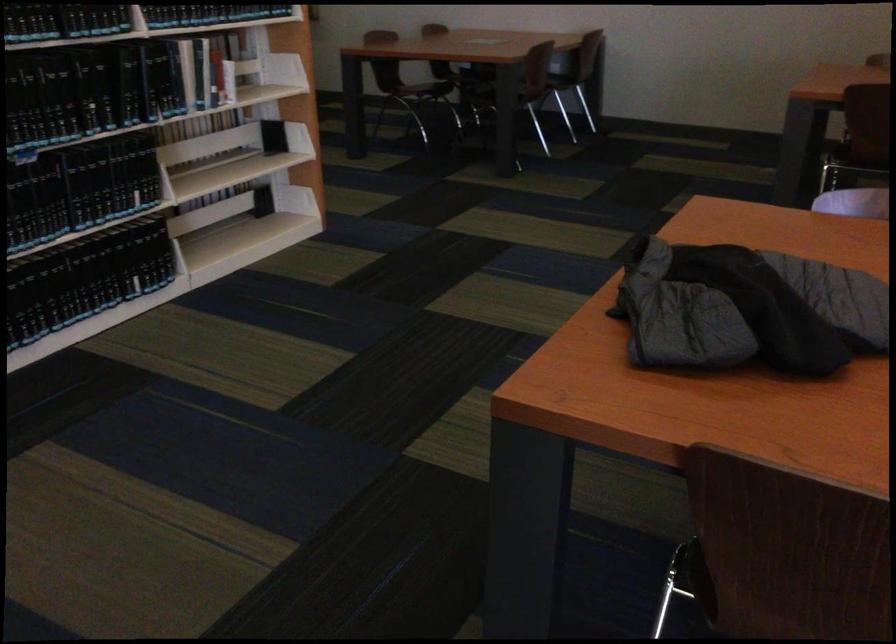
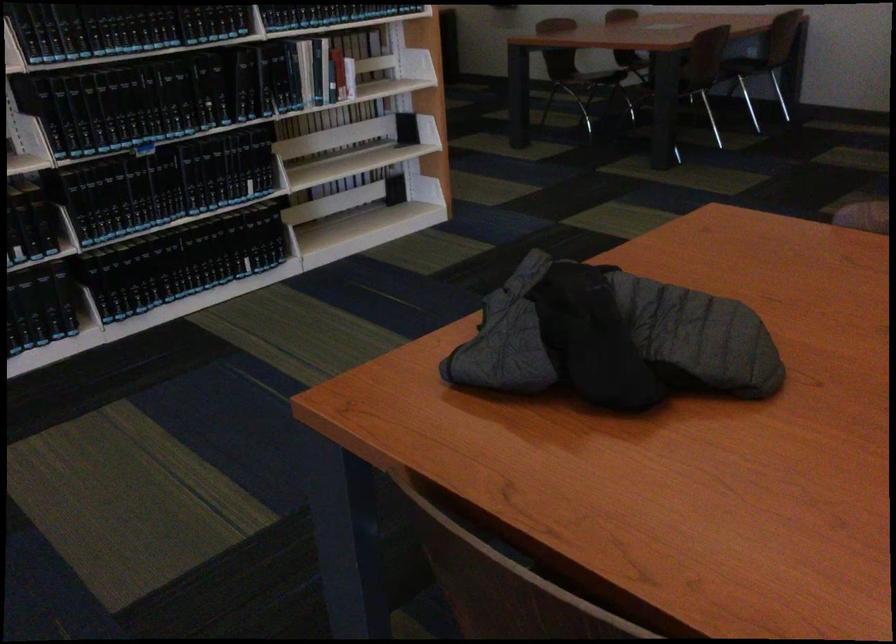
Where in the second image is the point corresponding to (558,73) from the first image?

(743, 58)